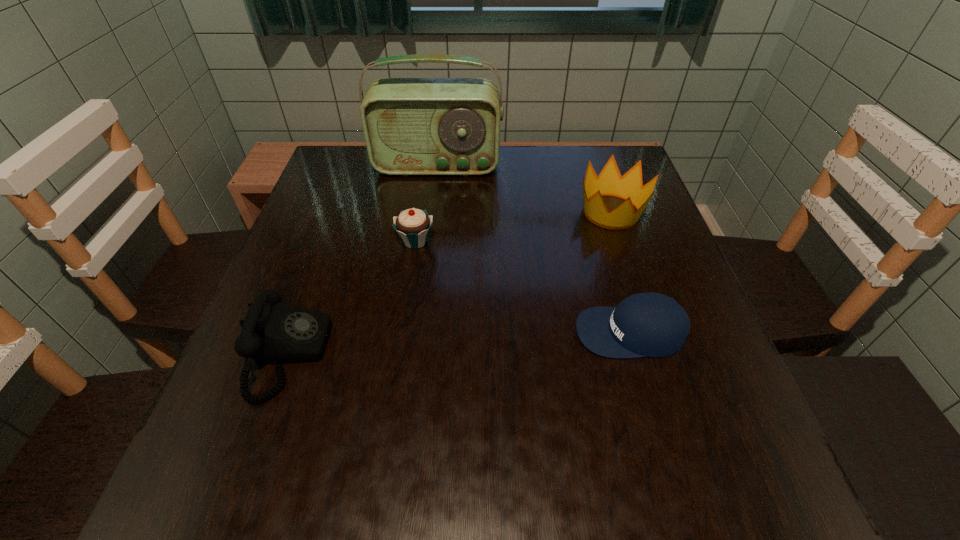
Identify the location of radio receiver. (412, 126).

The image size is (960, 540). Identify the location of the farthest object. (412, 126).

Identify the location of crown. The width and height of the screenshot is (960, 540). (609, 182).

Locate an element on the screen. The width and height of the screenshot is (960, 540). cupcake is located at coordinates (413, 225).

Find the location of a particular element. The image size is (960, 540). telephone is located at coordinates (272, 331).

At what (x,y) coordinates should I click in order to perform the action: click on baseball cap. Please return your answer as a coordinate pair (x, y). Image resolution: width=960 pixels, height=540 pixels. Looking at the image, I should click on (651, 324).

Locate an element on the screen. Image resolution: width=960 pixels, height=540 pixels. vacant space located on the front panel of the radio receiver is located at coordinates (423, 271).

Find the location of `free space located 0.200m on the back of the crown`. free space located 0.200m on the back of the crown is located at coordinates (590, 151).

Locate an element on the screen. The height and width of the screenshot is (540, 960). free space located on the right of the cupcake is located at coordinates (462, 241).

At what (x,y) coordinates should I click in order to perform the action: click on vacant space situated on the dial of the telephone. Please return your answer as a coordinate pair (x, y). Looking at the image, I should click on (398, 355).